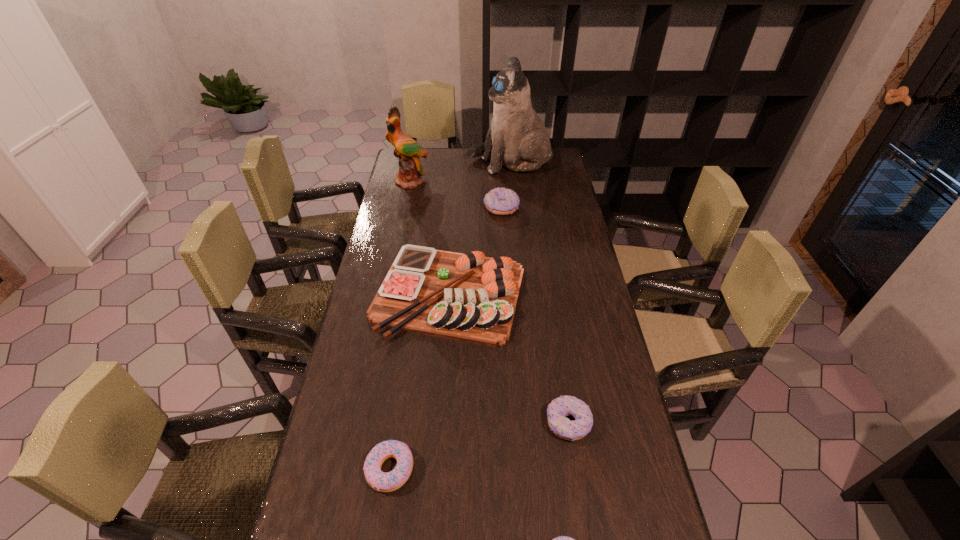
This screenshot has width=960, height=540. In order to click on the leftmost doughnut in this screenshot , I will do `click(383, 482)`.

This screenshot has width=960, height=540. Identify the location of blank space located 0.060m at the face of the tallest object. coord(454,163).

Find the location of a particular element. The height and width of the screenshot is (540, 960). vacant space located 0.130m at the face of the tallest object is located at coordinates (440, 163).

The height and width of the screenshot is (540, 960). Find the location of `vacant space situated 0.110m at the face of the tallest object`. vacant space situated 0.110m at the face of the tallest object is located at coordinates (444, 163).

This screenshot has width=960, height=540. Find the location of `vacant point located 0.110m on the front-facing side of the sixth shortest object`. vacant point located 0.110m on the front-facing side of the sixth shortest object is located at coordinates (405, 205).

At what (x,y) coordinates should I click in order to perform the action: click on free location located 0.200m on the back of the third tallest object. Please return your answer as a coordinate pair (x, y). This screenshot has width=960, height=540. Looking at the image, I should click on [454, 217].

Identify the location of vacant region located 0.050m on the right of the tallest doughnut. This screenshot has width=960, height=540. (531, 208).

The image size is (960, 540). In order to click on free region located on the left of the smaller brown doughnut in this screenshot , I will do pos(453,423).

Where is `free space located on the back of the farther purple doughnut`? free space located on the back of the farther purple doughnut is located at coordinates (400, 395).

You are a GUI agent. You are given a task and a screenshot of the screen. Output one action in this format:
    pyautogui.click(x=<x>, y=<y>)
    Task: Click on the cat present at the far edge
    The width and height of the screenshot is (960, 540).
    Given the screenshot: What is the action you would take?
    pyautogui.click(x=517, y=137)